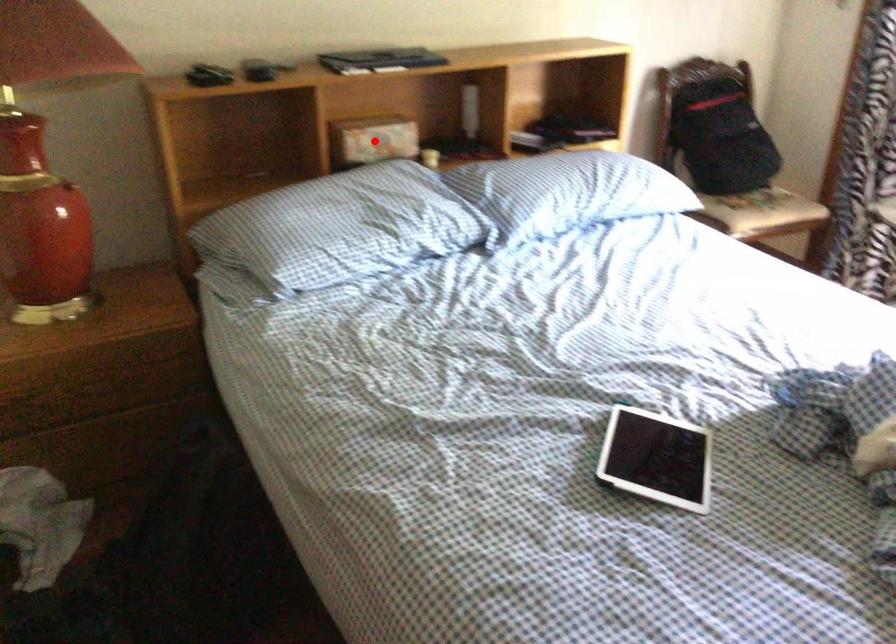
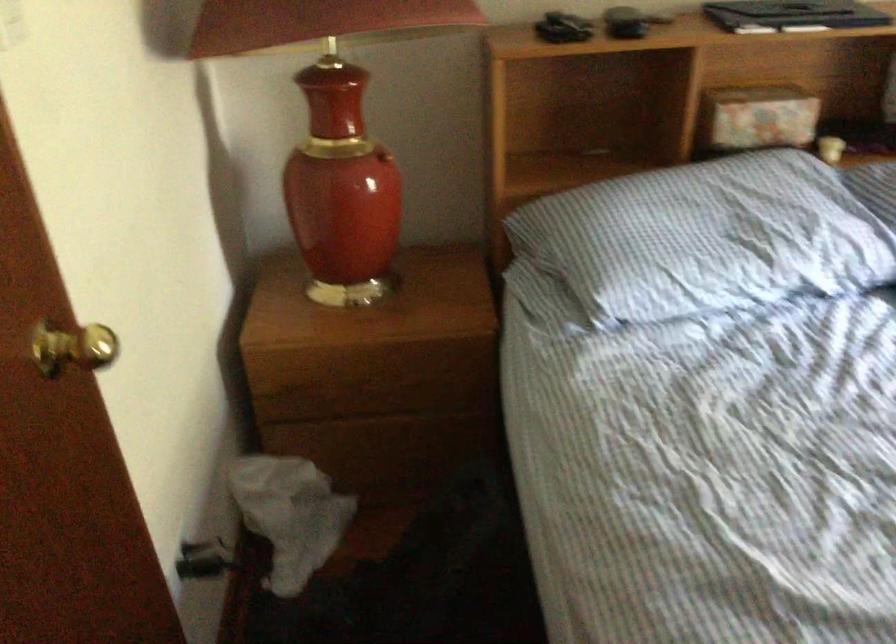
In the second image, find the point that corresponds to the highlighted location in the first image.

(757, 118)